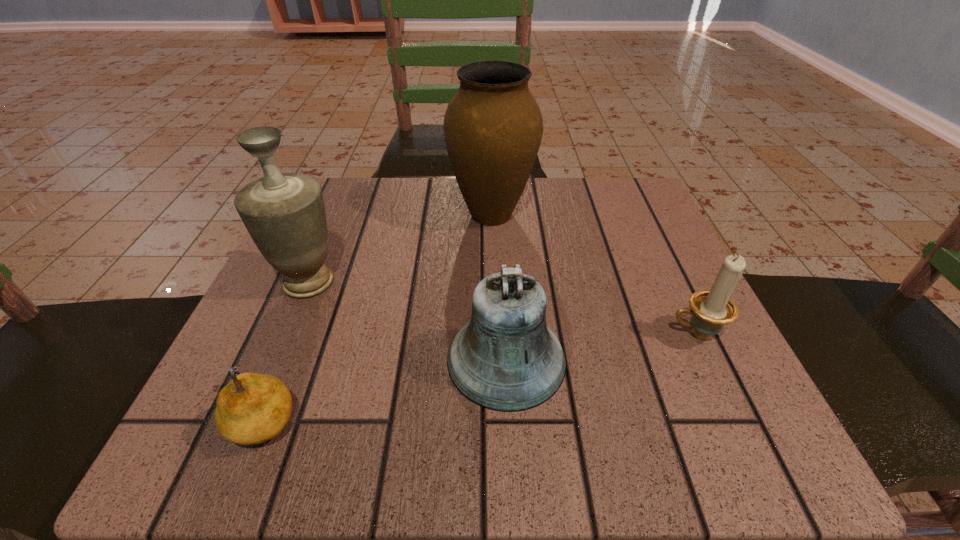
You are a GUI agent. You are given a task and a screenshot of the screen. Output one action in this format:
    pyautogui.click(x=<x>, y=<y>)
    Task: Click on the vacant position located 0.250m on the handle side of the candle_holder
    
    Given the screenshot: What is the action you would take?
    pyautogui.click(x=507, y=334)

Identify the location of vacant space located 0.100m on the handle side of the candle_holder. The height and width of the screenshot is (540, 960). (604, 334).

Identify the location of blank space located on the handle side of the candle_holder. (411, 334).

Where is `vacant space located on the right of the pear`? The width and height of the screenshot is (960, 540). vacant space located on the right of the pear is located at coordinates (361, 418).

In order to click on object present at the far edge in this screenshot , I will do `click(493, 127)`.

Find the location of a particular element. The width and height of the screenshot is (960, 540). bell at the near edge is located at coordinates (506, 359).

At what (x,y) coordinates should I click in order to perform the action: click on pear that is at the near edge. Please return your answer as a coordinate pair (x, y). The image size is (960, 540). Looking at the image, I should click on (253, 408).

Where is `urn located at the left edge`? Image resolution: width=960 pixels, height=540 pixels. urn located at the left edge is located at coordinates (284, 213).

Locate an element on the screen. The width and height of the screenshot is (960, 540). pear positioned at the left edge is located at coordinates (253, 408).

Locate an element on the screen. This screenshot has height=540, width=960. object that is at the right edge is located at coordinates (711, 309).